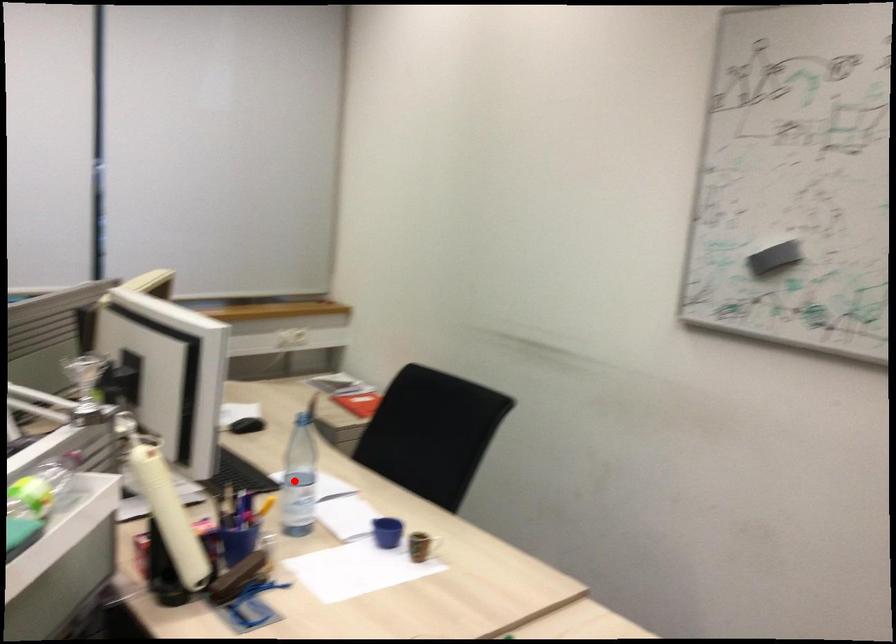
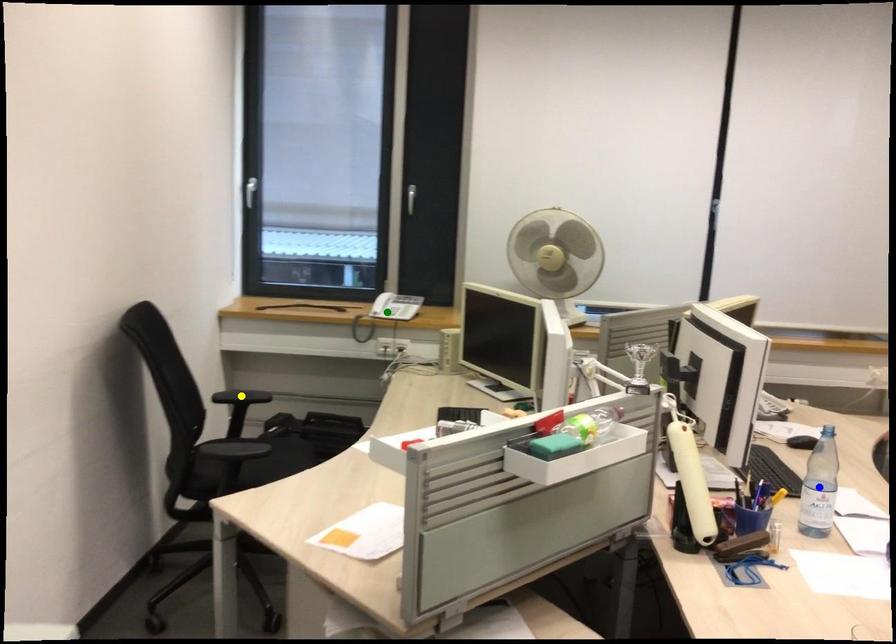
Question: I am providing you with two images of the same scene from different viewpoints. A red point is marked on the first image. You are given multiple points on the second image. Which point in image 2 is actually the same real-world point as the red point in image 1?

Choices:
 (A) blue point
 (B) green point
 (C) yellow point

Answer: (A)